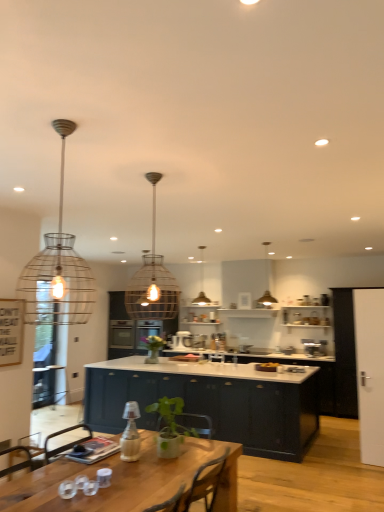
Find the location of a particular element. The height and width of the screenshot is (512, 384). free spot above wire mesh pendant light at upper left, the 1th lamp in the front-to-back sequence (from a real-world perspective) is located at coordinates (59, 123).